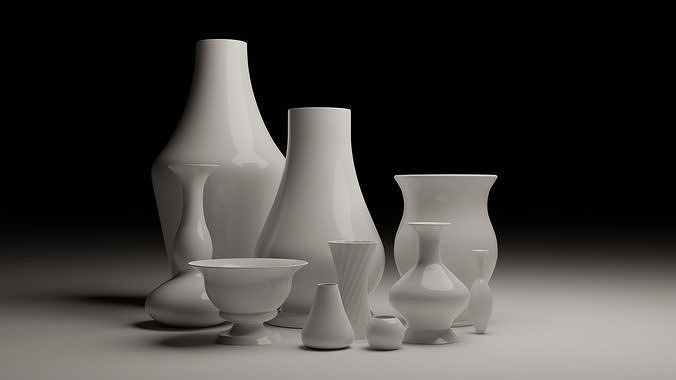
The width and height of the screenshot is (676, 380). In order to click on 5 small vases in this screenshot , I will do `click(391, 339)`, `click(320, 326)`, `click(481, 316)`, `click(362, 288)`, `click(428, 305)`.